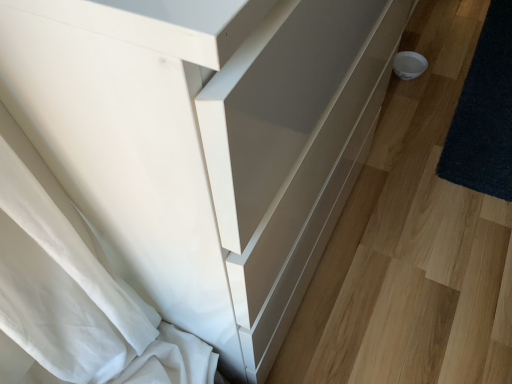
Question: Does white glossy drawer at lower right appear on the left side of dark blue shaggy rug at lower right?

Choices:
 (A) yes
 (B) no

Answer: (A)

Question: Is white glossy drawer at lower right not close to dark blue shaggy rug at lower right?

Choices:
 (A) no
 (B) yes

Answer: (A)

Question: Would you say white glossy drawer at lower right contains dark blue shaggy rug at lower right?

Choices:
 (A) no
 (B) yes

Answer: (B)

Question: Does white glossy drawer at lower right have a larger size compared to dark blue shaggy rug at lower right?

Choices:
 (A) yes
 (B) no

Answer: (A)

Question: Does white glossy drawer at lower right touch dark blue shaggy rug at lower right?

Choices:
 (A) yes
 (B) no

Answer: (B)

Question: Is white glossy drawer at lower right outside of dark blue shaggy rug at lower right?

Choices:
 (A) yes
 (B) no

Answer: (A)

Question: Could white glossy drawer at lower right be considered to be inside dark blue shaggy rug at lower right?

Choices:
 (A) no
 (B) yes

Answer: (A)

Question: Is dark blue shaggy rug at lower right further to camera compared to white glossy drawer at lower right?

Choices:
 (A) no
 (B) yes

Answer: (B)

Question: Is dark blue shaggy rug at lower right not close to white glossy drawer at lower right?

Choices:
 (A) yes
 (B) no

Answer: (B)

Question: Does dark blue shaggy rug at lower right appear on the left side of white glossy drawer at lower right?

Choices:
 (A) yes
 (B) no

Answer: (B)

Question: Is dark blue shaggy rug at lower right looking in the opposite direction of white glossy drawer at lower right?

Choices:
 (A) no
 (B) yes

Answer: (B)

Question: Could you tell me if dark blue shaggy rug at lower right is facing white glossy drawer at lower right?

Choices:
 (A) yes
 (B) no

Answer: (A)

Question: Considering the positions of point (373, 44) and point (460, 158), is point (373, 44) closer or farther from the camera than point (460, 158)?

Choices:
 (A) farther
 (B) closer

Answer: (B)